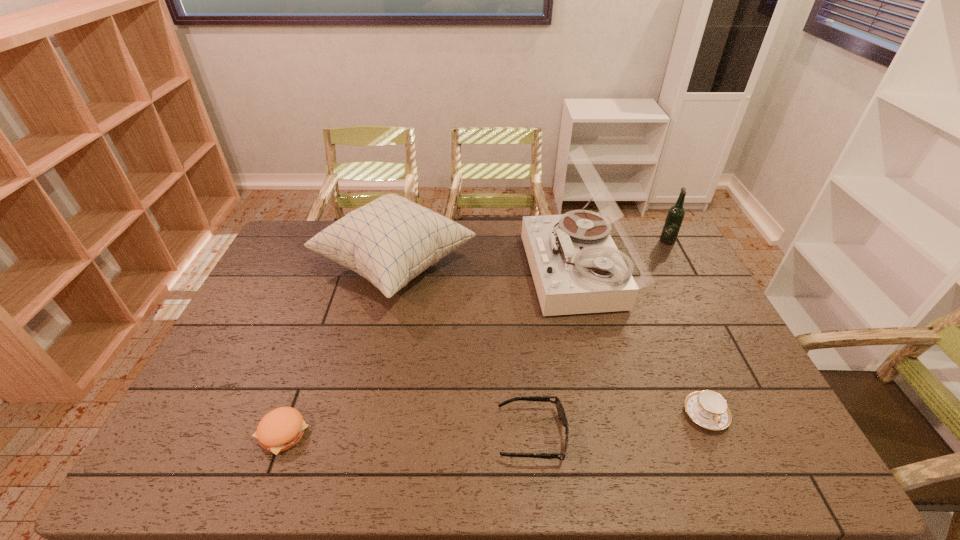
Locate an element on the screen. vacant space that satisfies the following two spatial constraints: 1. on the back side of the rightmost object; 2. on the right side of the record player is located at coordinates (569, 239).